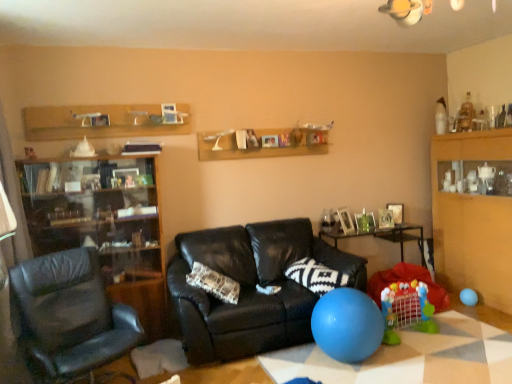
Question: Is wooden shelf at upper center beside blue rubber ball at lower center, which is counted as the second table, starting from the back?

Choices:
 (A) yes
 (B) no

Answer: (B)

Question: Is wooden shelf at upper center behind blue rubber ball at lower center, acting as the second table starting from the top?

Choices:
 (A) yes
 (B) no

Answer: (A)

Question: Is wooden shelf at upper center wider than blue rubber ball at lower center, acting as the second table starting from the top?

Choices:
 (A) yes
 (B) no

Answer: (B)

Question: Can you confirm if wooden shelf at upper center is smaller than blue rubber ball at lower center, acting as the second table starting from the top?

Choices:
 (A) no
 (B) yes

Answer: (A)

Question: From the image's perspective, does wooden shelf at upper center appear lower than blue rubber ball at lower center, which is counted as the second table, starting from the back?

Choices:
 (A) yes
 (B) no

Answer: (B)

Question: Can you confirm if wooden shelf at upper center is shorter than blue rubber ball at lower center, which is the 1th table from bottom to top?

Choices:
 (A) yes
 (B) no

Answer: (B)

Question: From a real-world perspective, is matte black cabinet at left below wooden shelf at upper center?

Choices:
 (A) yes
 (B) no

Answer: (A)

Question: Is matte black cabinet at left next to wooden shelf at upper center?

Choices:
 (A) no
 (B) yes

Answer: (A)

Question: Does matte black cabinet at left have a greater height compared to wooden shelf at upper center?

Choices:
 (A) yes
 (B) no

Answer: (A)

Question: Can you confirm if matte black cabinet at left is positioned to the left of wooden shelf at upper center?

Choices:
 (A) yes
 (B) no

Answer: (A)

Question: Considering the relative sizes of matte black cabinet at left and wooden shelf at upper center in the image provided, is matte black cabinet at left smaller than wooden shelf at upper center?

Choices:
 (A) yes
 (B) no

Answer: (B)

Question: Can you confirm if matte black cabinet at left is bigger than wooden shelf at upper center?

Choices:
 (A) no
 (B) yes

Answer: (B)

Question: Considering the relative sizes of wooden shelf at upper center and wooden cabinet at right in the image provided, is wooden shelf at upper center wider than wooden cabinet at right?

Choices:
 (A) no
 (B) yes

Answer: (A)